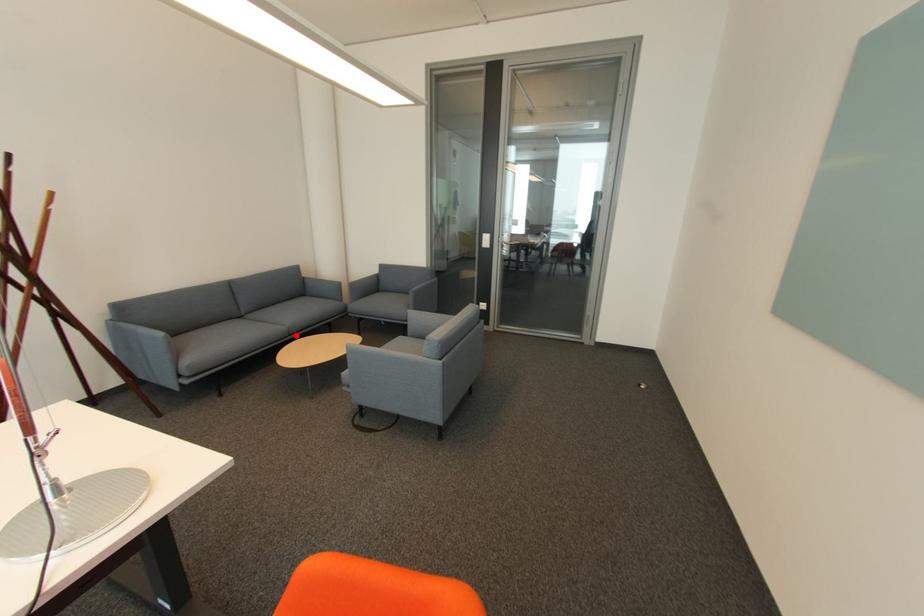
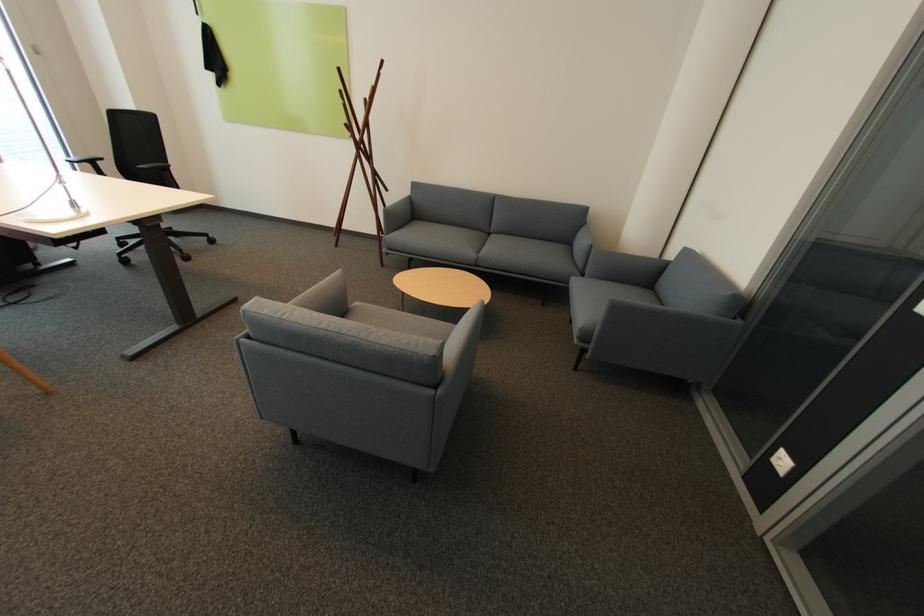
In the second image, find the point that corresponds to the highlighted location in the first image.

(482, 265)